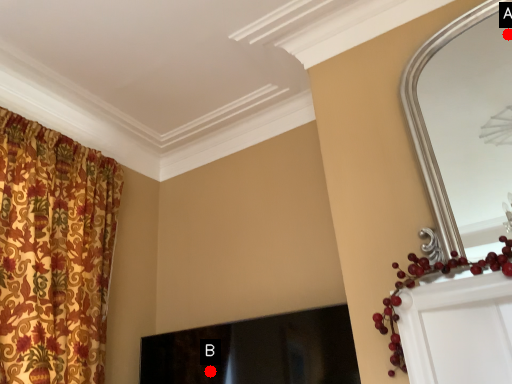
Question: Two points are circled on the image, labeled by A and B beside each circle. Which of the following is the farthest from the observer?

Choices:
 (A) A is further
 (B) B is further

Answer: (A)